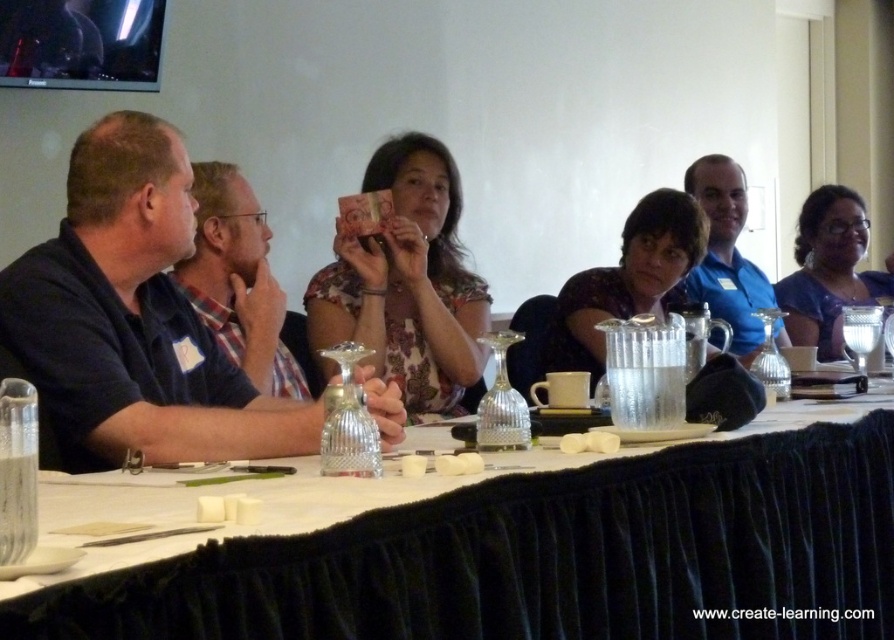
You are organizing a photo shoot and need to position two models based on their clothing. The models are wearing a blue plaid shirt at left and a blue satin dress at right. According to the scene, which model should be placed more to the left?

The blue plaid shirt at left should be placed more to the left because it is positioned on the left side of the blue satin dress at right.

You are standing 2 meters away from the table and want to reach the point marked as point (x=855, y=547) on the table. Can you safely step forward to reach it without overextending?

The distance of point (x=855, y=547) from the camera is 2.19 meters. Since you are already 2 meters away, stepping forward would bring you within reach as the total distance is slightly more than your current position. However, ensure you don not overextend beyond your comfortable reach.